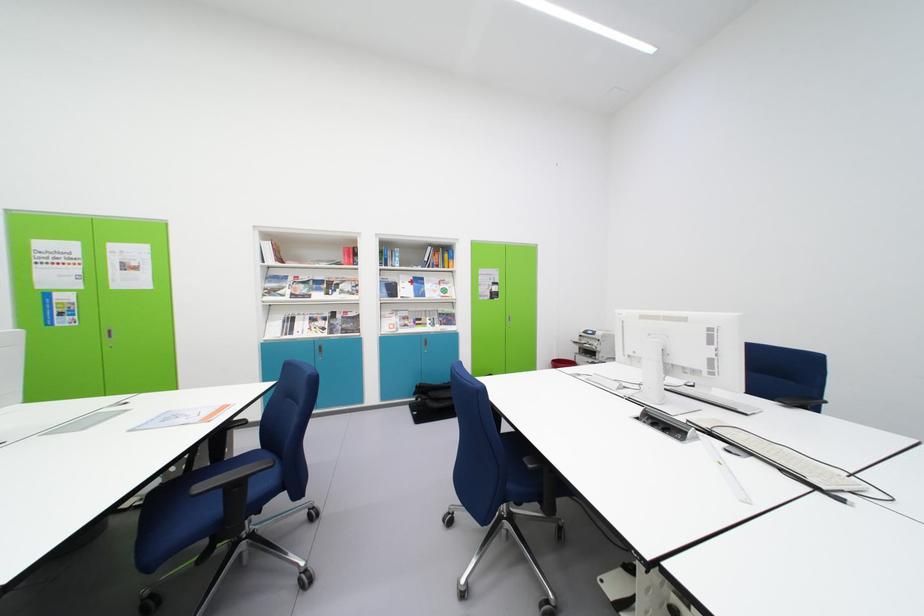
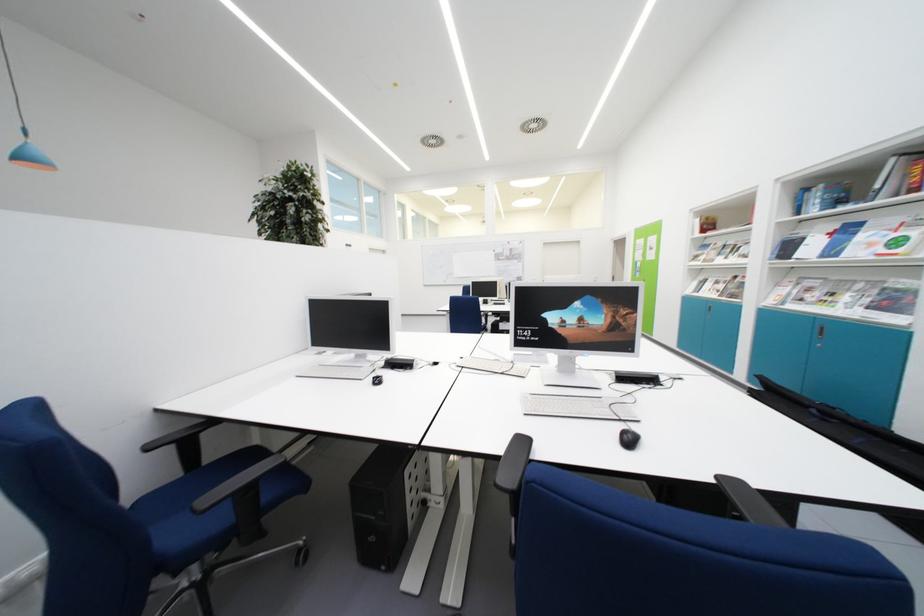
The point at [441,294] is marked in the first image. Where is the corresponding point in the second image?

(878, 249)